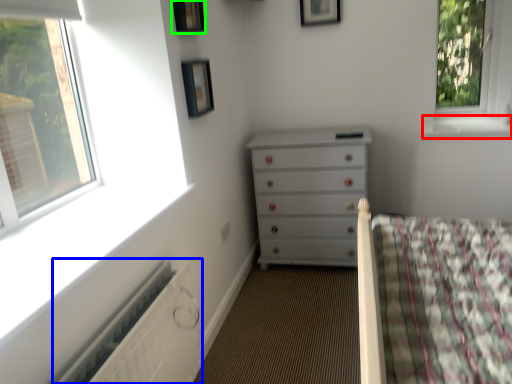
Question: Considering the real-world distances, which object is closest to window sill (highlighted by a red box)? radiator (highlighted by a blue box) or picture frame (highlighted by a green box).

Choices:
 (A) radiator
 (B) picture frame

Answer: (B)